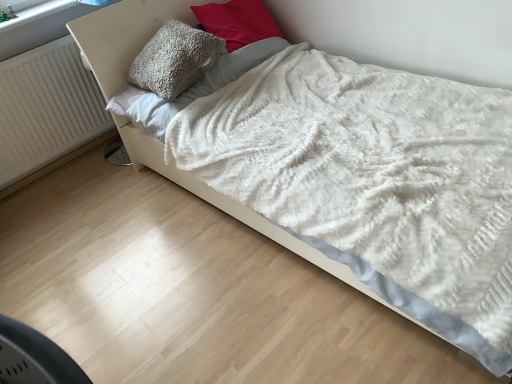
Question: Considering the relative positions of white ribbed radiator at left and fuzzy gray pillow at upper center, which is the second pillow in left-to-right order, in the image provided, is white ribbed radiator at left behind fuzzy gray pillow at upper center, which is the second pillow in left-to-right order,?

Choices:
 (A) no
 (B) yes

Answer: (A)

Question: Is white ribbed radiator at left positioned with its back to fuzzy gray pillow at upper center, which is the second pillow in left-to-right order?

Choices:
 (A) no
 (B) yes

Answer: (A)

Question: Is white ribbed radiator at left to the right of fuzzy gray pillow at upper center, the 1th pillow positioned from the right, from the viewer's perspective?

Choices:
 (A) yes
 (B) no

Answer: (B)

Question: Does white ribbed radiator at left have a smaller size compared to fuzzy gray pillow at upper center, the 1th pillow positioned from the right?

Choices:
 (A) no
 (B) yes

Answer: (B)

Question: From a real-world perspective, is white ribbed radiator at left located beneath fuzzy gray pillow at upper center, the 1th pillow positioned from the right?

Choices:
 (A) yes
 (B) no

Answer: (A)

Question: From a real-world perspective, is white ribbed radiator at left physically located above or below fluffy gray pillow at upper center, which is counted as the second pillow, starting from the right?

Choices:
 (A) above
 (B) below

Answer: (B)

Question: Is white ribbed radiator at left in front of or behind fluffy gray pillow at upper center, which is counted as the second pillow, starting from the right, in the image?

Choices:
 (A) front
 (B) behind

Answer: (B)

Question: Would you say white ribbed radiator at left is to the left or to the right of fluffy gray pillow at upper center, positioned as the 1th pillow in left-to-right order, in the picture?

Choices:
 (A) left
 (B) right

Answer: (A)

Question: Considering the positions of white ribbed radiator at left and fluffy gray pillow at upper center, positioned as the 1th pillow in left-to-right order, in the image, is white ribbed radiator at left bigger or smaller than fluffy gray pillow at upper center, positioned as the 1th pillow in left-to-right order,?

Choices:
 (A) big
 (B) small

Answer: (B)

Question: Based on their sizes in the image, would you say white fluffy sheet at upper center is bigger or smaller than fuzzy gray pillow at upper center, the 1th pillow positioned from the right?

Choices:
 (A) big
 (B) small

Answer: (B)

Question: Considering the positions of white fluffy sheet at upper center and fuzzy gray pillow at upper center, which is the second pillow in left-to-right order, in the image, is white fluffy sheet at upper center taller or shorter than fuzzy gray pillow at upper center, which is the second pillow in left-to-right order,?

Choices:
 (A) short
 (B) tall

Answer: (A)

Question: In terms of width, does white fluffy sheet at upper center look wider or thinner when compared to fuzzy gray pillow at upper center, which is the second pillow in left-to-right order?

Choices:
 (A) wide
 (B) thin

Answer: (A)

Question: In the image, is white fluffy sheet at upper center on the left side or the right side of fuzzy gray pillow at upper center, which is the second pillow in left-to-right order?

Choices:
 (A) right
 (B) left

Answer: (B)

Question: Would you say white fluffy sheet at upper center is to the left or to the right of fluffy gray pillow at upper center, positioned as the 1th pillow in left-to-right order, in the picture?

Choices:
 (A) right
 (B) left

Answer: (B)

Question: Considering the positions of white fluffy sheet at upper center and fluffy gray pillow at upper center, positioned as the 1th pillow in left-to-right order, in the image, is white fluffy sheet at upper center wider or thinner than fluffy gray pillow at upper center, positioned as the 1th pillow in left-to-right order,?

Choices:
 (A) thin
 (B) wide

Answer: (A)